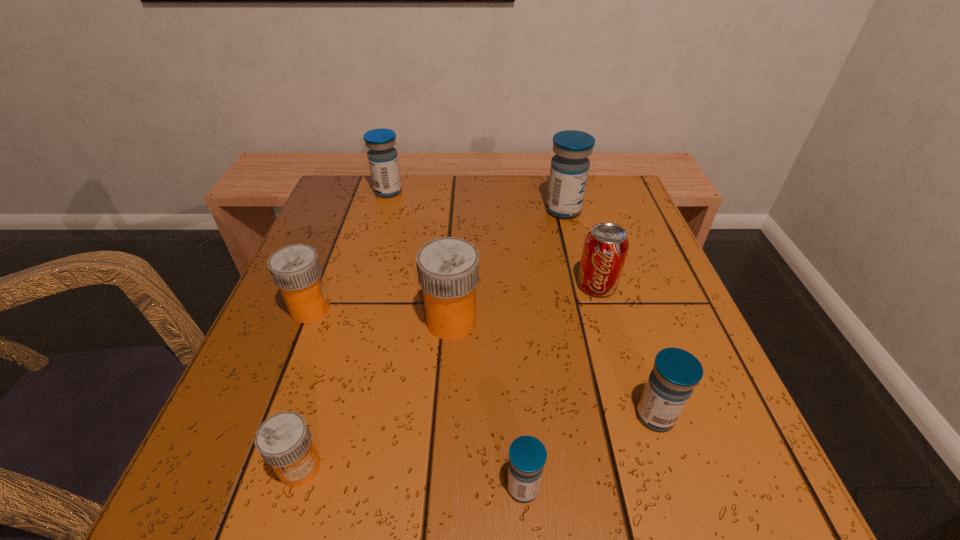
The image size is (960, 540). I want to click on vacant position in the image that satisfies the following two spatial constraints: 1. on the label side of the third biggest blue medicine; 2. on the right side of the fourth medicine from left to right, so click(x=445, y=416).